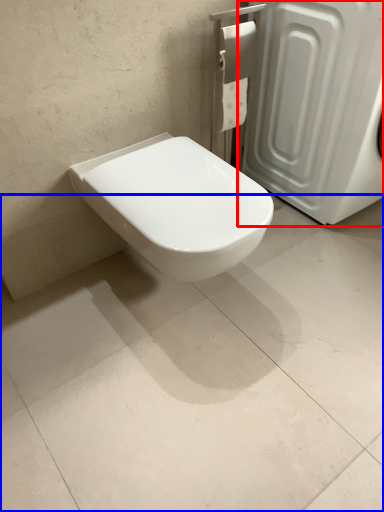
Question: Which of the following is the closest to the observer, screen door (highlighted by a red box) or concrete (highlighted by a blue box)?

Choices:
 (A) screen door
 (B) concrete

Answer: (B)